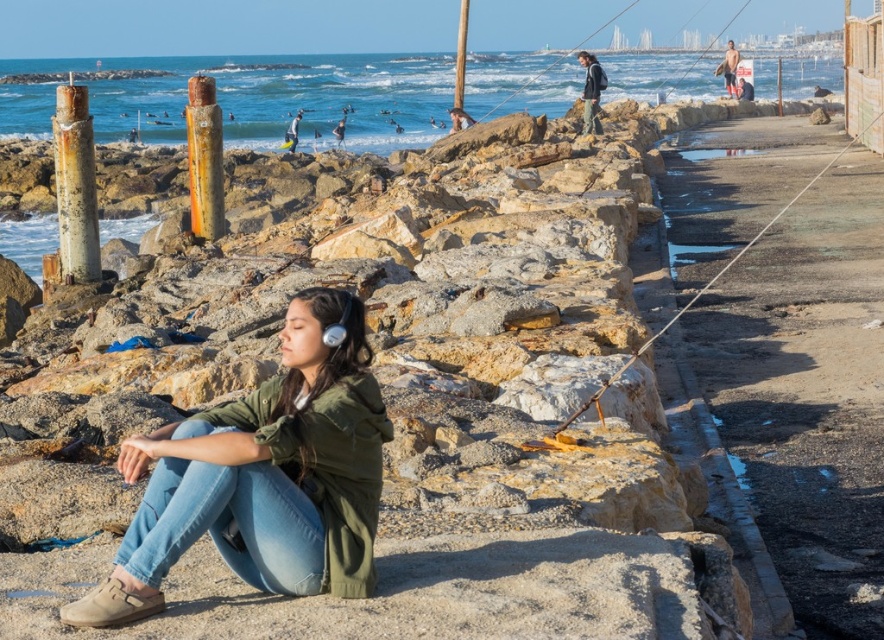
You are a photographer trying to capture the tan skin surfer at upper right and the rusty metal pole at left in the same frame. Which object should you position closer to the left side of your camera viewfinder?

The rusty metal pole at left should be positioned closer to the left side of your camera viewfinder since it is already on the left side of the tan skin surfer at upper right.

Consider the image. You are a photographer trying to capture the dark gray jacket at upper center in the frame. Based on its coordinates, where should you position your camera to ensure it is centered?

The dark gray jacket at upper center is located at point (591, 92), so you should position your camera to center it at those coordinates.